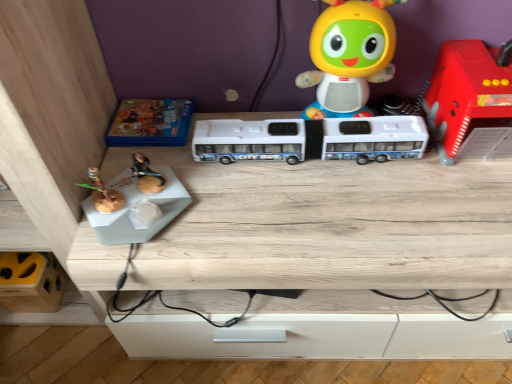
Question: Can you confirm if rubberized red fire truck at right, which is the 1th toy in right-to-left order, is positioned to the right of white plastic bus at center, acting as the third toy starting from the right?

Choices:
 (A) yes
 (B) no

Answer: (A)

Question: From the image's perspective, does rubberized red fire truck at right, the 5th toy positioned from the left, appear higher than white plastic bus at center, acting as the third toy starting from the right?

Choices:
 (A) yes
 (B) no

Answer: (A)

Question: Can you confirm if rubberized red fire truck at right, the 5th toy positioned from the left, is thinner than white plastic bus at center, the 3th toy positioned from the left?

Choices:
 (A) yes
 (B) no

Answer: (B)

Question: Is white plastic bus at center, acting as the third toy starting from the right, a part of rubberized red fire truck at right, which is the 1th toy in right-to-left order?

Choices:
 (A) no
 (B) yes

Answer: (A)

Question: Is rubberized red fire truck at right, the 5th toy positioned from the left, smaller than white plastic bus at center, the 3th toy positioned from the left?

Choices:
 (A) yes
 (B) no

Answer: (B)

Question: Is rubberized red fire truck at right, which is the 1th toy in right-to-left order, taller than white plastic bus at center, acting as the third toy starting from the right?

Choices:
 (A) yes
 (B) no

Answer: (A)

Question: From a real-world perspective, is matte plastic toy at upper center, arranged as the 2th toy when viewed from the right, on white plastic bus at center, the 3th toy positioned from the left?

Choices:
 (A) no
 (B) yes

Answer: (B)

Question: Does matte plastic toy at upper center, marked as the fourth toy in a left-to-right arrangement, touch white plastic bus at center, the 3th toy positioned from the left?

Choices:
 (A) no
 (B) yes

Answer: (A)

Question: Is matte plastic toy at upper center, arranged as the 2th toy when viewed from the right, outside of white plastic bus at center, the 3th toy positioned from the left?

Choices:
 (A) yes
 (B) no

Answer: (A)

Question: Is matte plastic toy at upper center, arranged as the 2th toy when viewed from the right, wider than white plastic bus at center, acting as the third toy starting from the right?

Choices:
 (A) yes
 (B) no

Answer: (A)

Question: From a real-world perspective, is matte plastic toy at upper center, marked as the fourth toy in a left-to-right arrangement, beneath white plastic bus at center, the 3th toy positioned from the left?

Choices:
 (A) no
 (B) yes

Answer: (A)

Question: Is matte plastic toy at upper center, marked as the fourth toy in a left-to-right arrangement, looking in the opposite direction of white plastic bus at center, the 3th toy positioned from the left?

Choices:
 (A) yes
 (B) no

Answer: (B)

Question: Does white plastic bus at center, acting as the third toy starting from the right, have a lesser width compared to blue cardboard box at upper left, the second toy in the left-to-right sequence?

Choices:
 (A) yes
 (B) no

Answer: (A)